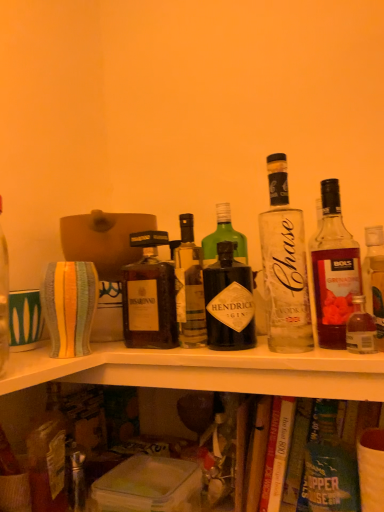
Question: Is translucent glass bottle at upper right, marked as the 2th bottle in a right-to-left arrangement, shorter than translucent glass bottle at upper right, marked as the first bottle in a right-to-left arrangement?

Choices:
 (A) yes
 (B) no

Answer: (B)

Question: Is translucent glass bottle at upper right, positioned as the fifth bottle in left-to-right order, at the left side of translucent glass bottle at upper right, marked as the first bottle in a right-to-left arrangement?

Choices:
 (A) no
 (B) yes

Answer: (B)

Question: From the image's perspective, is translucent glass bottle at upper right, marked as the 2th bottle in a right-to-left arrangement, below translucent glass bottle at upper right, the sixth bottle from the left?

Choices:
 (A) no
 (B) yes

Answer: (A)

Question: Does translucent glass bottle at upper right, positioned as the fifth bottle in left-to-right order, turn towards translucent glass bottle at upper right, the sixth bottle from the left?

Choices:
 (A) no
 (B) yes

Answer: (A)

Question: Does translucent glass bottle at upper right, marked as the 2th bottle in a right-to-left arrangement, lie behind translucent glass bottle at upper right, the sixth bottle from the left?

Choices:
 (A) yes
 (B) no

Answer: (A)

Question: From the image's perspective, is translucent glass bottle at upper right, marked as the 2th bottle in a right-to-left arrangement, over translucent glass bottle at upper right, marked as the first bottle in a right-to-left arrangement?

Choices:
 (A) no
 (B) yes

Answer: (B)

Question: From the image's perspective, would you say clear glass bottle at center, the third bottle in the left-to-right sequence, is shown under dark brown glass bottle at center, which is the 2th bottle in left-to-right order?

Choices:
 (A) yes
 (B) no

Answer: (B)

Question: Can you see clear glass bottle at center, the third bottle in the left-to-right sequence, touching dark brown glass bottle at center, the fifth bottle in the right-to-left sequence?

Choices:
 (A) no
 (B) yes

Answer: (A)

Question: Is clear glass bottle at center, the third bottle in the left-to-right sequence, not close to dark brown glass bottle at center, which is the 2th bottle in left-to-right order?

Choices:
 (A) no
 (B) yes

Answer: (A)

Question: Can you confirm if clear glass bottle at center, the third bottle in the left-to-right sequence, is bigger than dark brown glass bottle at center, which is the 2th bottle in left-to-right order?

Choices:
 (A) no
 (B) yes

Answer: (B)

Question: Could you tell me if clear glass bottle at center, the third bottle in the left-to-right sequence, is turned towards dark brown glass bottle at center, the fifth bottle in the right-to-left sequence?

Choices:
 (A) no
 (B) yes

Answer: (A)

Question: Is clear glass bottle at center, which appears as the 4th bottle when viewed from the right, to the left of dark brown glass bottle at center, the fifth bottle in the right-to-left sequence, from the viewer's perspective?

Choices:
 (A) yes
 (B) no

Answer: (B)

Question: Does translucent glass bottle at upper right, the sixth bottle from the left, come in front of hardcover book at lower center?

Choices:
 (A) no
 (B) yes

Answer: (B)